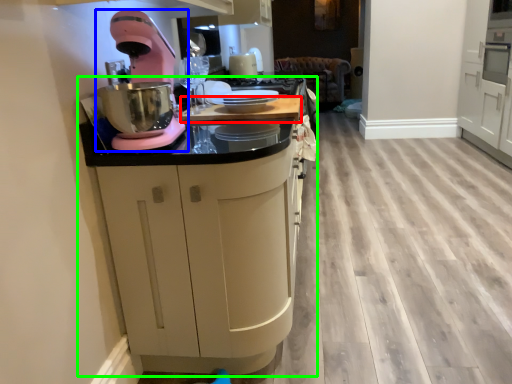
Question: Which is farther away from counter top (highlighted by a red box)? home appliance (highlighted by a blue box) or cabinetry (highlighted by a green box)?

Choices:
 (A) home appliance
 (B) cabinetry

Answer: (B)